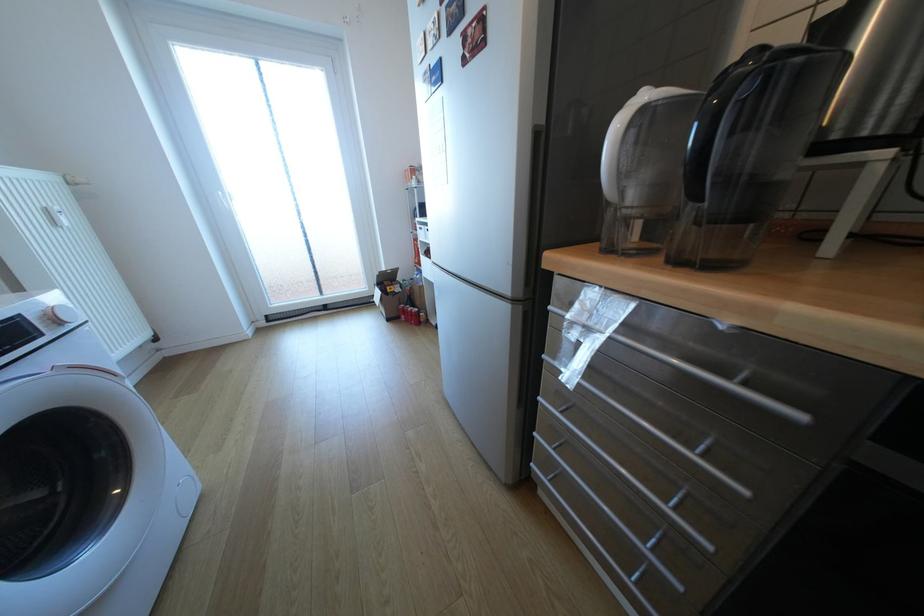
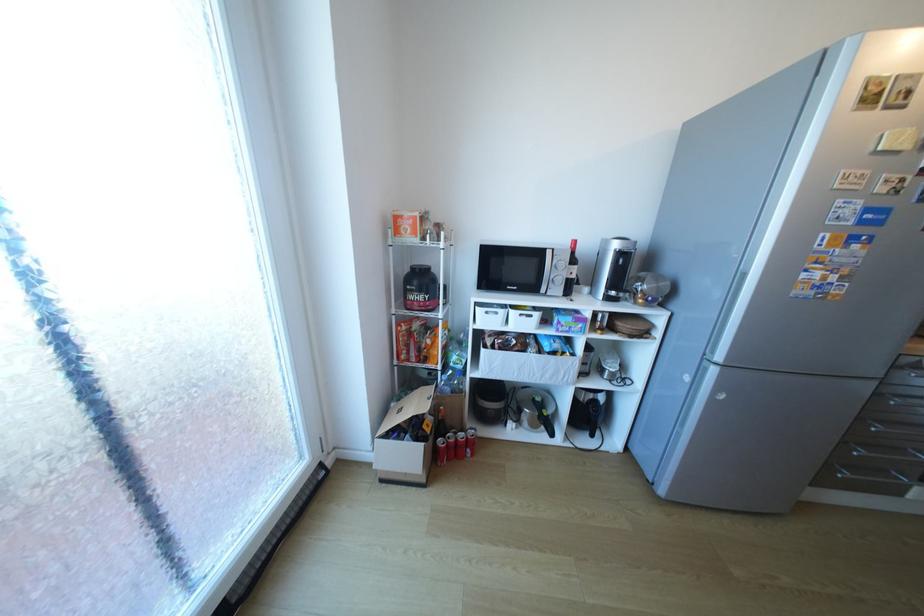
Find the pixel in the second image that matches the point at 430,229 in the first image.

(495, 313)